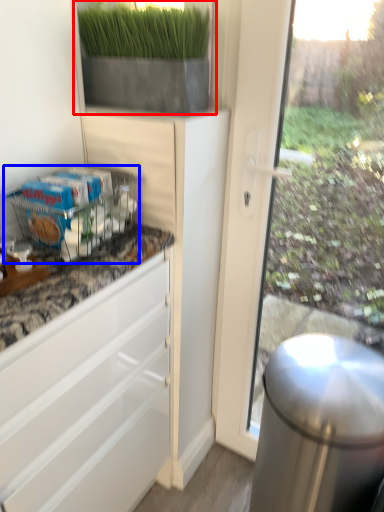
Question: Which object appears farthest to the camera in this image, houseplant (highlighted by a red box) or shelf (highlighted by a blue box)?

Choices:
 (A) houseplant
 (B) shelf

Answer: (A)